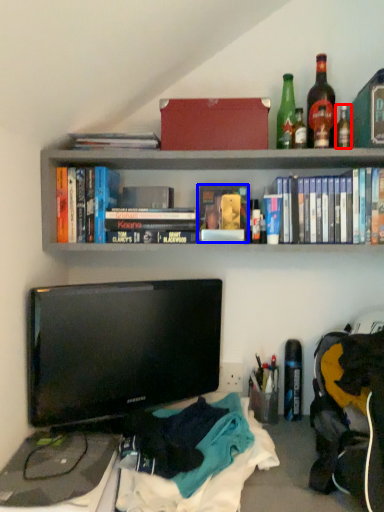
Question: Which object appears farthest to the camera in this image, bottle (highlighted by a red box) or paperback book (highlighted by a blue box)?

Choices:
 (A) bottle
 (B) paperback book

Answer: (B)